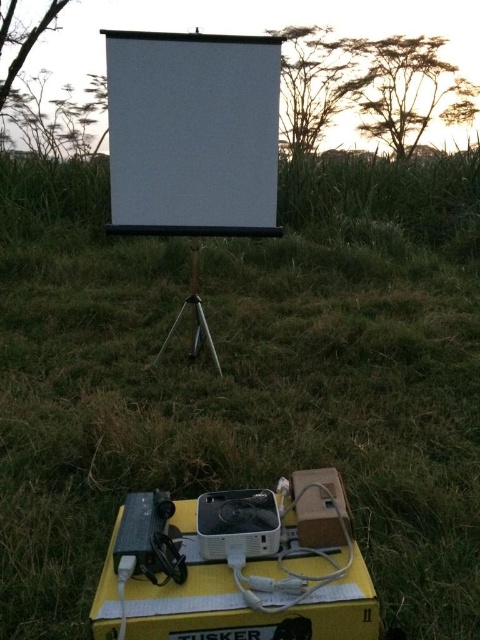
You are standing at the projector screen and want to reach both the point at coordinates point (206,502) and the point at coordinates point (275,129). Which point will you reach first?

Point point (206,502) is in front of point point (275,129), so you will reach point point (206,502) first.

You are setting up an outdoor movie night and need to position the white plastic projector at lower center correctly. According to the image, where should the projector be placed relative to the white matte projector screen at center?

The white plastic projector at lower center should be placed below the white matte projector screen at center as shown in the image.